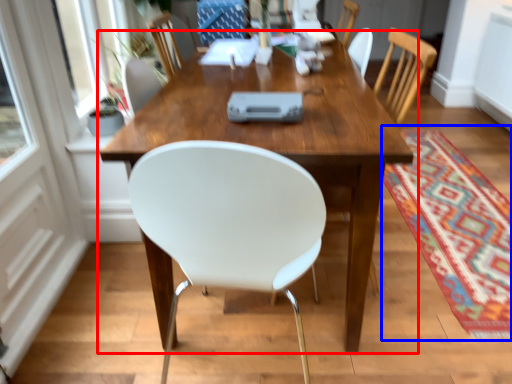
Question: Which point is further to the camera, table (highlighted by a red box) or mat (highlighted by a blue box)?

Choices:
 (A) table
 (B) mat

Answer: (B)